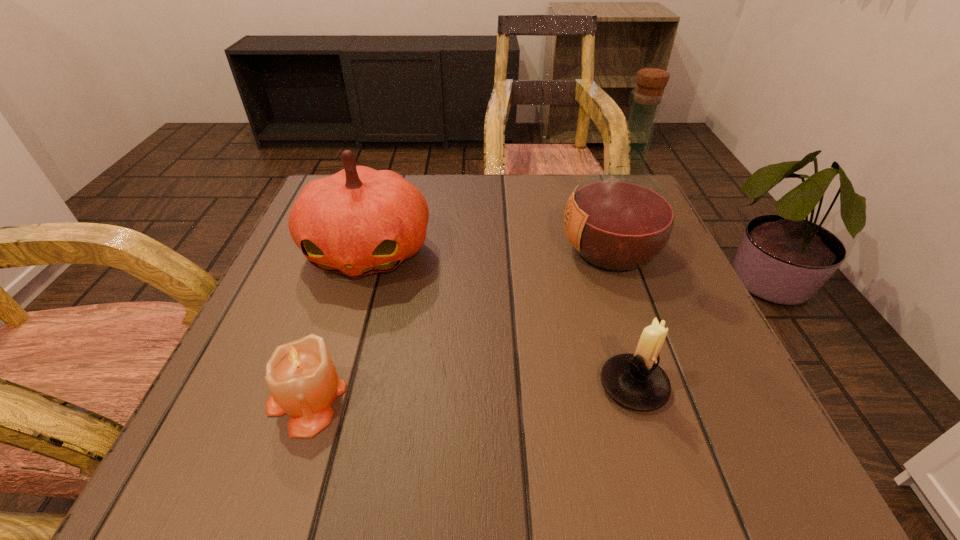
The height and width of the screenshot is (540, 960). In order to click on the tallest object in this screenshot , I will do `click(619, 219)`.

The width and height of the screenshot is (960, 540). What are the coordinates of `the third shortest object` in the screenshot? It's located at (359, 221).

Where is `the third tallest object`? the third tallest object is located at coordinates (636, 381).

This screenshot has height=540, width=960. I want to click on candle, so click(x=301, y=376).

This screenshot has height=540, width=960. What are the coordinates of `free spot located on the front label of the liquor` in the screenshot? It's located at (405, 251).

Find the location of `vacant region located on the front label of the liquor`. vacant region located on the front label of the liquor is located at coordinates (445, 251).

Locate an element on the screen. The image size is (960, 540). free space located on the front label of the liquor is located at coordinates (425, 251).

Find the location of a particular element. This screenshot has width=960, height=540. vacant space positioned 0.190m on the front-facing side of the pumpkin is located at coordinates (328, 382).

Where is `vacant space situated 0.130m on the left of the second shortest object`? The height and width of the screenshot is (540, 960). vacant space situated 0.130m on the left of the second shortest object is located at coordinates (512, 386).

This screenshot has height=540, width=960. What are the coordinates of `vacant space positioned 0.070m on the right of the shortest object` in the screenshot? It's located at (393, 398).